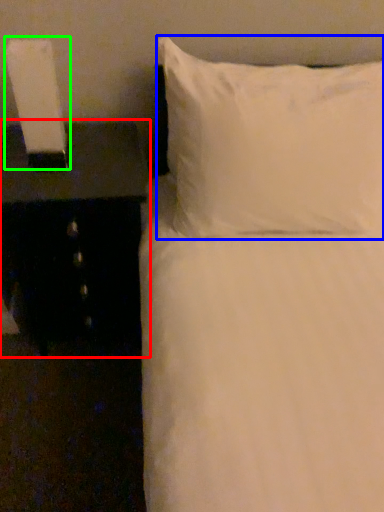
Question: Which object is positioned closest to nightstand (highlighted by a red box)? Select from pillow (highlighted by a blue box) and bedside lamp (highlighted by a green box).

Choices:
 (A) pillow
 (B) bedside lamp

Answer: (B)